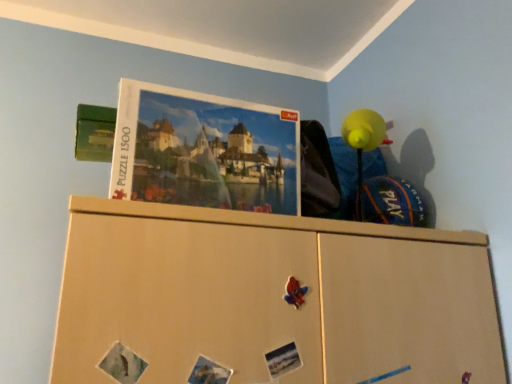
What do you see at coordinates (204, 151) in the screenshot? I see `matte cardboard puzzle at upper center` at bounding box center [204, 151].

Find the location of `matte cardboard puzzle at upper center`. matte cardboard puzzle at upper center is located at coordinates (x=204, y=151).

What is the approximate width of matte cardboard puzzle at upper center?

It is 3.11 inches.

You are a GUI agent. You are given a task and a screenshot of the screen. Output one action in this format:
    pyautogui.click(x=<x>, y=<y>)
    Task: Click on the matte cardboard puzzle at upper center
    This screenshot has width=512, height=384.
    Given the screenshot: What is the action you would take?
    pyautogui.click(x=204, y=151)